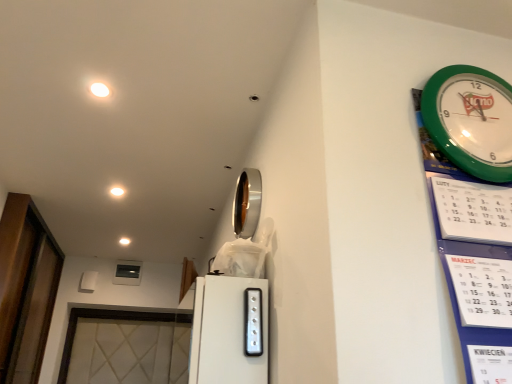
What is the approximate height of white glossy light at upper left, the second light from the left?

It is 0.39 inches.

Measure the distance between point [115,187] and camera.

6.73 feet.

What is the approximate height of silver/metallic mirror at upper center?

The height of silver/metallic mirror at upper center is 10.02 inches.

What do you see at coordinates (253, 322) in the screenshot?
I see `satin silver switch at center` at bounding box center [253, 322].

Where is `white glossy light at upper left, the second light in the front-to-back sequence`? The height and width of the screenshot is (384, 512). white glossy light at upper left, the second light in the front-to-back sequence is located at coordinates (117, 191).

Is white glossy light at upper center, the 1th light from the back, positioned behind satin silver switch at center?

Yes, the depth of white glossy light at upper center, the 1th light from the back, is greater than that of satin silver switch at center.

Looking at this image, in terms of size, does white glossy light at upper center, arranged as the 3th light when viewed from the front, appear bigger or smaller than satin silver switch at center?

Considering their sizes, white glossy light at upper center, arranged as the 3th light when viewed from the front, takes up less space than satin silver switch at center.

Could you tell me if white glossy light at upper center, the third light positioned from the right, is facing satin silver switch at center?

No.

Is satin silver switch at center inside transparent glass door at left?

No, satin silver switch at center is located outside of transparent glass door at left.

Which object is further away from the camera, transparent glass door at left or satin silver switch at center?

Positioned behind is transparent glass door at left.

Which of these two, transparent glass door at left or satin silver switch at center, is wider?

transparent glass door at left.

Does transparent glass door at left have a lesser height compared to satin silver switch at center?

Incorrect, the height of transparent glass door at left does not fall short of that of satin silver switch at center.

From a real-world perspective, is silver/metallic mirror at upper center positioned over white glossy light at upper left, which is the first light from right to left, based on gravity?

No, from a real-world perspective, silver/metallic mirror at upper center is not over white glossy light at upper left, which is the first light from right to left

Considering the sizes of objects silver/metallic mirror at upper center and white glossy light at upper left, which is the 3th light in bottom-to-top order, in the image provided, who is shorter, silver/metallic mirror at upper center or white glossy light at upper left, which is the 3th light in bottom-to-top order,?

white glossy light at upper left, which is the 3th light in bottom-to-top order, is shorter.

Can you tell me how much silver/metallic mirror at upper center and white glossy light at upper left, which is the first light from right to left, differ in facing direction?

The angle between the facing direction of silver/metallic mirror at upper center and the facing direction of white glossy light at upper left, which is the first light from right to left, is 89.4 degrees.

Which of these two, silver/metallic mirror at upper center or white glossy light at upper left, positioned as the 3th light in back-to-front order, is thinner?

Thinner between the two is silver/metallic mirror at upper center.

Which of these two, green plastic wall clock at upper right or white glossy light at upper left, which is counted as the 2th light, starting from the bottom, stands taller?

green plastic wall clock at upper right is taller.

Are green plastic wall clock at upper right and white glossy light at upper left, the 2th light when ordered from back to front, far apart?

Yes, green plastic wall clock at upper right and white glossy light at upper left, the 2th light when ordered from back to front, are quite far apart.

Is green plastic wall clock at upper right bigger than white glossy light at upper left, the second light when ordered from top to bottom?

Indeed, green plastic wall clock at upper right has a larger size compared to white glossy light at upper left, the second light when ordered from top to bottom.

In the image, is green plastic wall clock at upper right on the left side or the right side of white glossy light at upper left, the 2th light when ordered from back to front?

From the image, it's evident that green plastic wall clock at upper right is to the right of white glossy light at upper left, the 2th light when ordered from back to front.

Is white glossy light at upper left, the 3th light in the left-to-right sequence, to the right of silver/metallic mirror at upper center from the viewer's perspective?

No.

Considering the relative sizes of white glossy light at upper left, acting as the first light starting from the front, and silver/metallic mirror at upper center in the image provided, is white glossy light at upper left, acting as the first light starting from the front, wider than silver/metallic mirror at upper center?

Correct, the width of white glossy light at upper left, acting as the first light starting from the front, exceeds that of silver/metallic mirror at upper center.

From a real-world perspective, is white glossy light at upper left, positioned as the 3th light in back-to-front order, on top of silver/metallic mirror at upper center?

Indeed, from a real-world perspective, white glossy light at upper left, positioned as the 3th light in back-to-front order, stands above silver/metallic mirror at upper center.

Is silver/metallic mirror at upper center at the back of white glossy light at upper left, which is the first light from right to left?

No, white glossy light at upper left, which is the first light from right to left, is not facing away from silver/metallic mirror at upper center.

Could you measure the distance between white glossy light at upper left, which is the 3th light in bottom-to-top order, and white glossy light at upper left, the second light when ordered from top to bottom?

white glossy light at upper left, which is the 3th light in bottom-to-top order, and white glossy light at upper left, the second light when ordered from top to bottom, are 78.19 centimeters apart.

Considering the relative positions of white glossy light at upper left, acting as the first light starting from the front, and white glossy light at upper left, the second light when ordered from top to bottom, in the image provided, is white glossy light at upper left, acting as the first light starting from the front, to the left of white glossy light at upper left, the second light when ordered from top to bottom, from the viewer's perspective?

In fact, white glossy light at upper left, acting as the first light starting from the front, is to the right of white glossy light at upper left, the second light when ordered from top to bottom.

Is white glossy light at upper left, which is the 3th light in bottom-to-top order, facing towards white glossy light at upper left, which is counted as the 2th light, starting from the bottom?

No, white glossy light at upper left, which is the 3th light in bottom-to-top order, is not aimed at white glossy light at upper left, which is counted as the 2th light, starting from the bottom.

Which is in front, point (98, 87) or point (119, 195)?

Point (98, 87)

Can you tell me how much white glossy light at upper center, the 1th light from the back, and white glossy light at upper left, which is the 3th light in bottom-to-top order, differ in facing direction?

The angular difference between white glossy light at upper center, the 1th light from the back, and white glossy light at upper left, which is the 3th light in bottom-to-top order, is 3.44 degrees.

Visually, is white glossy light at upper center, the third light positioned from the right, positioned to the left or to the right of white glossy light at upper left, which is the 3th light in bottom-to-top order?

Clearly, white glossy light at upper center, the third light positioned from the right, is on the left of white glossy light at upper left, which is the 3th light in bottom-to-top order, in the image.

Consider the image. From a real-world perspective, which is physically above, white glossy light at upper center, the first light when ordered from left to right, or white glossy light at upper left, which is the first light from right to left?

white glossy light at upper center, the first light when ordered from left to right, is physically above.

Is white glossy light at upper center, the first light when ordered from left to right, thinner than white glossy light at upper left, the 3th light in the left-to-right sequence?

No, white glossy light at upper center, the first light when ordered from left to right, is not thinner than white glossy light at upper left, the 3th light in the left-to-right sequence.

Identify the location of light that is the 3rd one when counting backward from the satin silver switch at center. The width and height of the screenshot is (512, 384). (124, 241).

Image resolution: width=512 pixels, height=384 pixels. Identify the location of appliance located in front of the transparent glass door at left. click(253, 322).

Based on their spatial positions, is transparent glass door at left or white glossy light at upper left, the 3th light in the left-to-right sequence, closer to white glossy light at upper center, arranged as the 3th light when viewed from the front?

transparent glass door at left is closer to white glossy light at upper center, arranged as the 3th light when viewed from the front.

Which object lies nearer to the anchor point white glossy light at upper left, which is the 3th light in bottom-to-top order, transparent glass door at left or silver/metallic mirror at upper center?

Based on the image, silver/metallic mirror at upper center appears to be nearer to white glossy light at upper left, which is the 3th light in bottom-to-top order.

Estimate the real-world distances between objects in this image. Which object is further from silver/metallic mirror at upper center, white glossy light at upper left, the second light when ordered from top to bottom, or satin silver switch at center?

Based on the image, white glossy light at upper left, the second light when ordered from top to bottom, appears to be further to silver/metallic mirror at upper center.

Estimate the real-world distances between objects in this image. Which object is closer to white glossy light at upper left, the second light in the front-to-back sequence, transparent glass door at left or satin silver switch at center?

transparent glass door at left lies closer to white glossy light at upper left, the second light in the front-to-back sequence, than the other object.

Based on their spatial positions, is white glossy light at upper center, arranged as the 3th light when viewed from the front, or transparent glass door at left further from satin silver switch at center?

transparent glass door at left.

Based on their spatial positions, is green plastic wall clock at upper right or transparent glass door at left further from white glossy light at upper center, the first light positioned from the bottom?

green plastic wall clock at upper right lies further to white glossy light at upper center, the first light positioned from the bottom, than the other object.

Considering their positions, is white glossy light at upper left, positioned as the 3th light in back-to-front order, positioned closer to green plastic wall clock at upper right than satin silver switch at center?

satin silver switch at center is positioned closer to the anchor green plastic wall clock at upper right.

Estimate the real-world distances between objects in this image. Which object is closer to silver/metallic mirror at upper center, white glossy light at upper left, which is the first light from right to left, or white glossy light at upper left, the second light when ordered from top to bottom?

white glossy light at upper left, which is the first light from right to left, lies closer to silver/metallic mirror at upper center than the other object.

Where is `mirror between transparent glass door at left and satin silver switch at center in the horizontal direction`? The height and width of the screenshot is (384, 512). mirror between transparent glass door at left and satin silver switch at center in the horizontal direction is located at coordinates (247, 203).

Identify the location of mirror between satin silver switch at center and white glossy light at upper left, the second light in the front-to-back sequence, along the z-axis. Image resolution: width=512 pixels, height=384 pixels. (247, 203).

At what (x,y) coordinates should I click in order to perform the action: click on light located between white glossy light at upper left, the 3th light in the left-to-right sequence, and white glossy light at upper center, the 1th light from the back, in the depth direction. Please return your answer as a coordinate pair (x, y). Image resolution: width=512 pixels, height=384 pixels. Looking at the image, I should click on (117, 191).

This screenshot has width=512, height=384. Find the location of `glass door between satin silver switch at center and white glossy light at upper center, arranged as the 3th light when viewed from the front, from front to back`. glass door between satin silver switch at center and white glossy light at upper center, arranged as the 3th light when viewed from the front, from front to back is located at coordinates (25, 288).